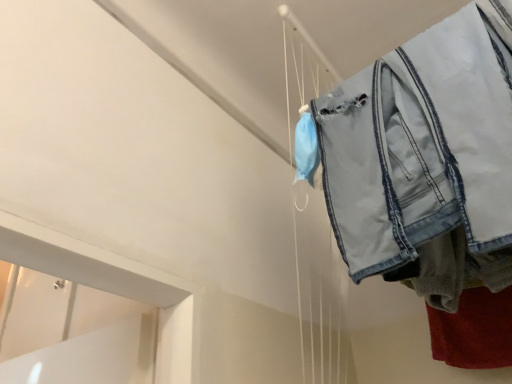
Identify the location of denim pants at upper right. (423, 144).

Measure the distance between denim pants at upper right and camera.

The depth of denim pants at upper right is 22.76 inches.

What do you see at coordinates (423, 144) in the screenshot?
I see `denim pants at upper right` at bounding box center [423, 144].

What are the coordinates of `denim pants at upper right` in the screenshot? It's located at (423, 144).